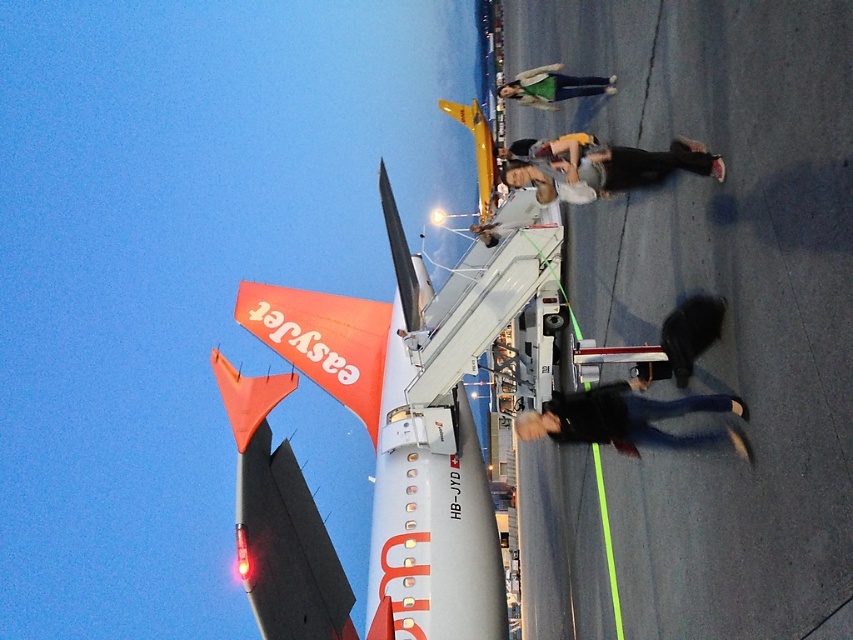
Based on the photo, is orange matte airplane tail at upper left thinner than black matte jacket at lower right?

No, orange matte airplane tail at upper left is not thinner than black matte jacket at lower right.

Which is above, orange matte airplane tail at upper left or black matte jacket at lower right?

orange matte airplane tail at upper left is higher up.

Between point (473, 566) and point (519, 422), which one is positioned in front?

Positioned in front is point (519, 422).

Where is `orange matte airplane tail at upper left`? The width and height of the screenshot is (853, 640). orange matte airplane tail at upper left is located at coordinates (397, 465).

Based on the photo, does orange matte airplane tail at upper left come in front of matte gray jacket at center?

No, it is behind matte gray jacket at center.

Can you confirm if orange matte airplane tail at upper left is wider than matte gray jacket at center?

Indeed, orange matte airplane tail at upper left has a greater width compared to matte gray jacket at center.

This screenshot has width=853, height=640. I want to click on orange matte airplane tail at upper left, so click(x=397, y=465).

The width and height of the screenshot is (853, 640). I want to click on orange matte airplane tail at upper left, so click(x=397, y=465).

Which is behind, point (663, 442) or point (538, 77)?

Positioned behind is point (538, 77).

Measure the distance between black matte jacket at lower right and camera.

They are 28.79 meters apart.

Identify the location of black matte jacket at lower right. pos(630,420).